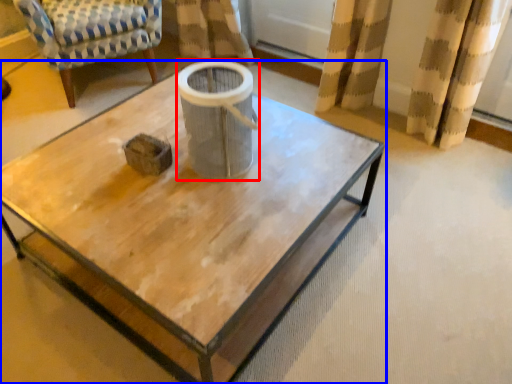
Question: Which object is closer to the camera taking this photo, gray (highlighted by a red box) or coffee table (highlighted by a blue box)?

Choices:
 (A) gray
 (B) coffee table

Answer: (B)